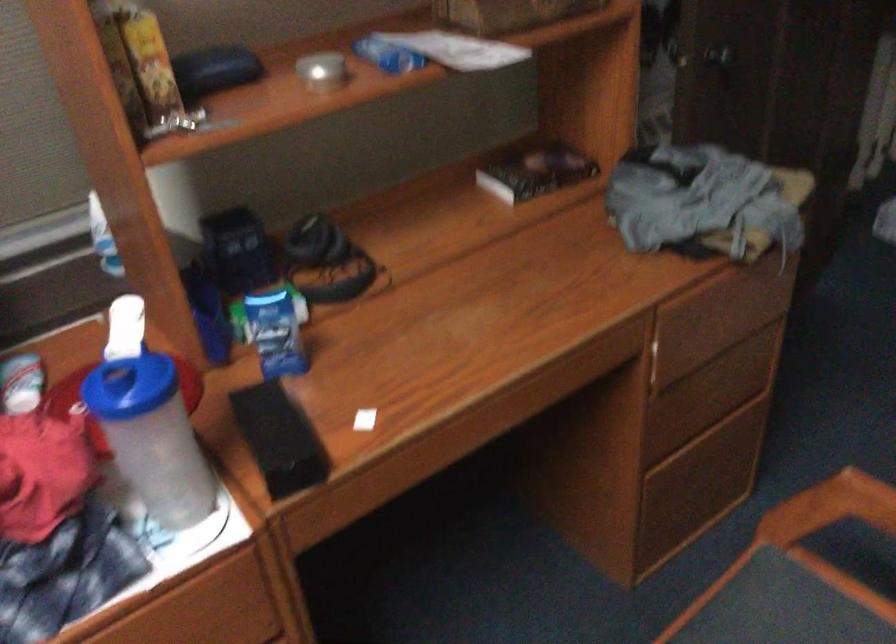
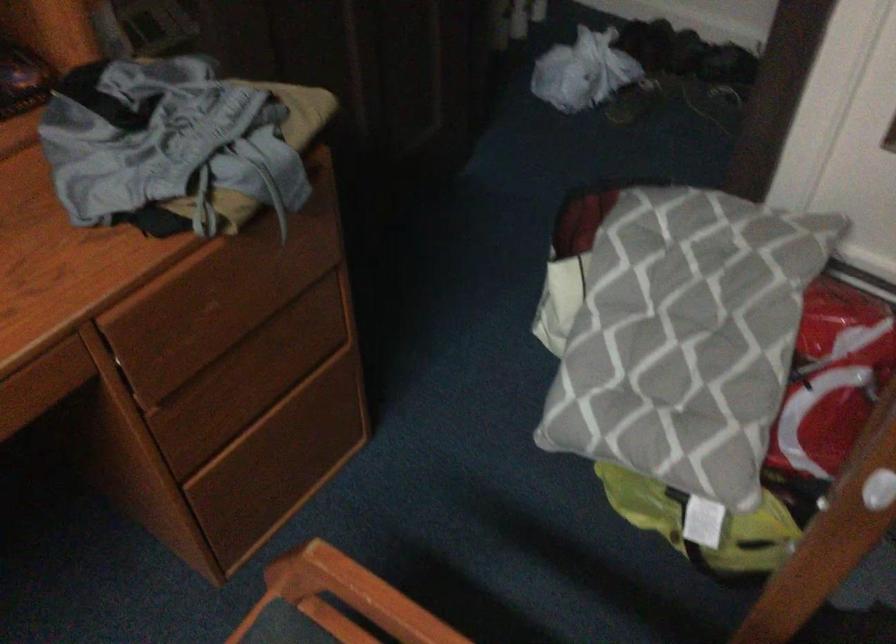
The point at (707, 397) is marked in the first image. Where is the corresponding point in the second image?

(254, 377)